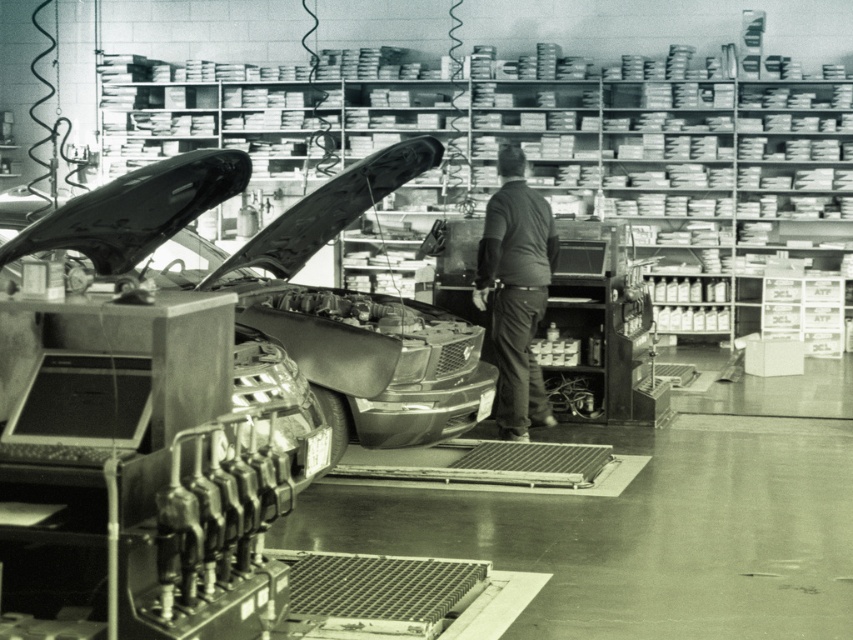
Question: Among these objects, which one is farthest from the camera?

Choices:
 (A) shiny chrome car at center
 (B) dark gray shirt at center

Answer: (B)

Question: Is shiny chrome car at center smaller than dark gray shirt at center?

Choices:
 (A) yes
 (B) no

Answer: (B)

Question: Does shiny chrome car at center have a larger size compared to dark gray shirt at center?

Choices:
 (A) no
 (B) yes

Answer: (B)

Question: Which point is closer to the camera?

Choices:
 (A) dark gray shirt at center
 (B) shiny chrome car at center

Answer: (B)

Question: Is shiny chrome car at center positioned in front of dark gray shirt at center?

Choices:
 (A) no
 (B) yes

Answer: (B)

Question: Among these points, which one is nearest to the camera?

Choices:
 (A) (398, 410)
 (B) (509, 307)

Answer: (A)